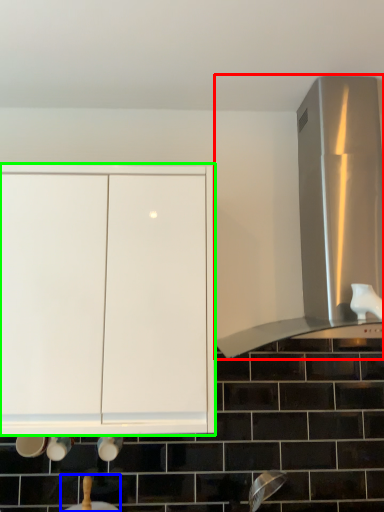
Question: Which object is positioned farthest from vent (highlighted by a red box)? Select from sink (highlighted by a blue box) and cabinetry (highlighted by a green box).

Choices:
 (A) sink
 (B) cabinetry

Answer: (A)